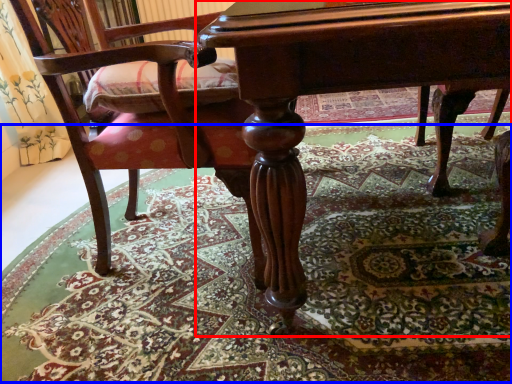
Question: Which object is further to the camera taking this photo, table (highlighted by a red box) or mat (highlighted by a blue box)?

Choices:
 (A) table
 (B) mat

Answer: (B)